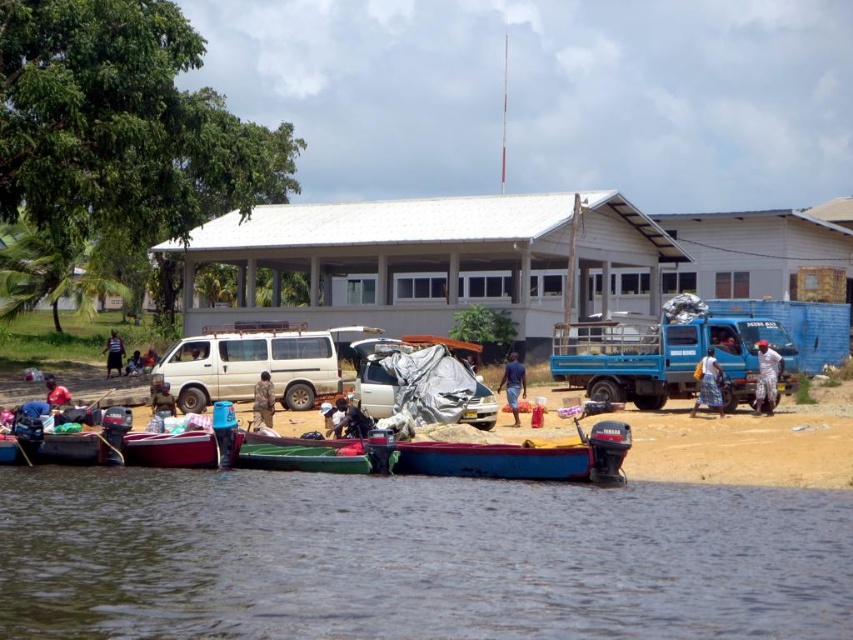
Question: Is blue fabric at center to the right of dark blue fabric at center from the viewer's perspective?

Choices:
 (A) yes
 (B) no

Answer: (A)

Question: Does brown water at lower center have a greater width compared to wooden canoe at center?

Choices:
 (A) no
 (B) yes

Answer: (B)

Question: Which is farther from the white matte van at center?

Choices:
 (A) red fabric bag at lower left
 (B) damaged silver car at center
 (C) blue fabric at center
 (D) dark blue fabric at lower left

Answer: (D)

Question: Estimate the real-world distances between objects in this image. Which object is farther from the blue printed fabric at center?

Choices:
 (A) brown fabric person at lower left
 (B) camouflage fabric person at center

Answer: (A)

Question: Which point is farther to the camera?

Choices:
 (A) dark blue fabric pants at right
 (B) wooden canoe at center

Answer: (A)

Question: Can you confirm if white matte van at center is thinner than dark blue fabric pants at right?

Choices:
 (A) no
 (B) yes

Answer: (A)